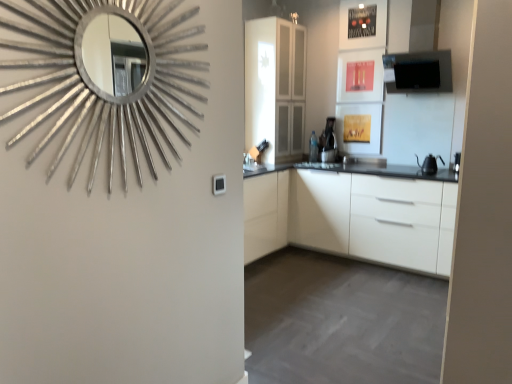
Question: From a real-world perspective, is white glossy sink at center above or below black matte exhaust hood at upper right?

Choices:
 (A) above
 (B) below

Answer: (B)

Question: Considering the positions of white glossy sink at center and black matte exhaust hood at upper right in the image, is white glossy sink at center taller or shorter than black matte exhaust hood at upper right?

Choices:
 (A) short
 (B) tall

Answer: (A)

Question: Estimate the real-world distances between objects in this image. Which object is closer to the white glossy sink at center?

Choices:
 (A) silver metallic mirror at upper left
 (B) black matte kettle at right
 (C) black matte exhaust hood at upper right
 (D) black plastic coffee machine at center
 (E) white matte cabinet at center

Answer: (E)

Question: Which object is positioned farthest from the white matte cabinet at center?

Choices:
 (A) black matte kettle at right
 (B) silver metallic mirror at upper left
 (C) transparent glass cabinet at center
 (D) white glossy sink at center
 (E) black plastic coffee machine at center

Answer: (B)